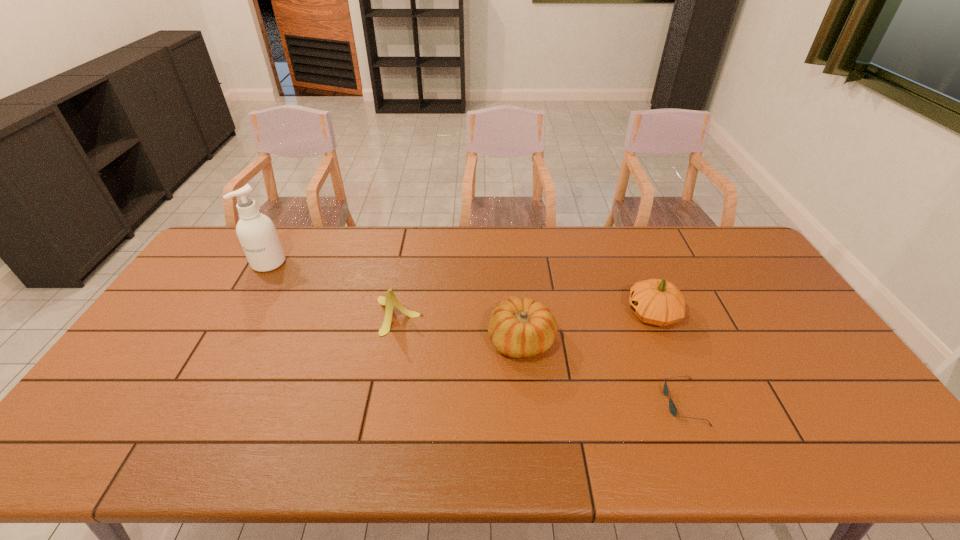
In the image, there is a desktop. Where is `vacant space at the right edge`? Image resolution: width=960 pixels, height=540 pixels. vacant space at the right edge is located at coordinates (770, 312).

The image size is (960, 540). In order to click on blank space at the far left corner in this screenshot , I will do `click(241, 263)`.

What are the coordinates of `free spot at the far right corner of the desktop` in the screenshot? It's located at (698, 228).

The height and width of the screenshot is (540, 960). What are the coordinates of `vacant region between the tallest object and the banana` in the screenshot? It's located at (333, 289).

The image size is (960, 540). I want to click on free space between the third object from right to left and the banana, so click(x=460, y=328).

This screenshot has width=960, height=540. In order to click on vacant space in between the third object from right to left and the nearest object in this screenshot , I will do `click(602, 372)`.

This screenshot has width=960, height=540. In order to click on vacant space that's between the second object from left to right and the shortest object in this screenshot , I will do `click(540, 359)`.

This screenshot has width=960, height=540. Identify the location of vacant area that lies between the banana and the farthest object. coord(333,289).

Image resolution: width=960 pixels, height=540 pixels. I want to click on vacant area that lies between the right gourd and the leftmost object, so click(x=461, y=288).

The width and height of the screenshot is (960, 540). I want to click on vacant area that lies between the banana and the farthest object, so click(333, 289).